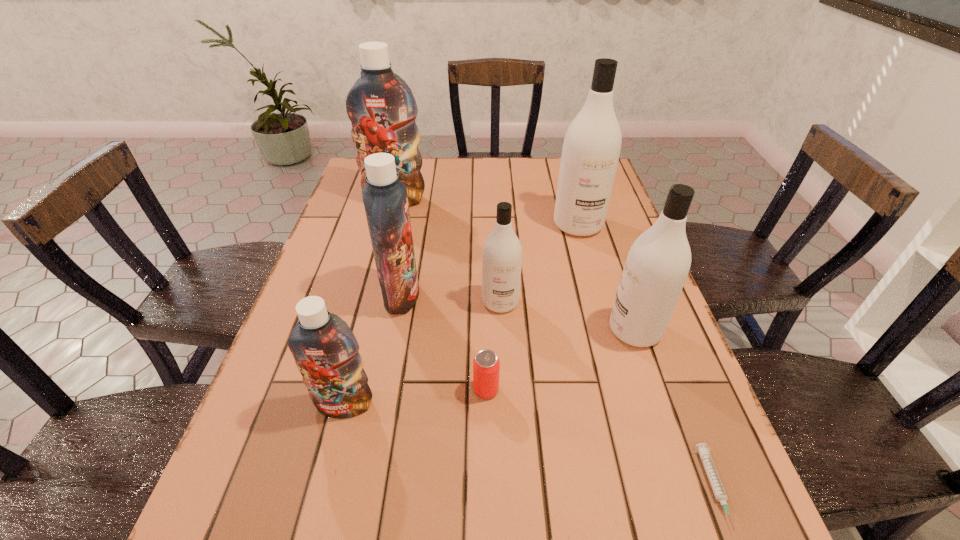
In order to click on free space located on the front label of the nearest shampoo in this screenshot , I will do `click(329, 462)`.

The height and width of the screenshot is (540, 960). I want to click on free space located on the front-facing side of the leftmost white shampoo, so click(x=502, y=346).

The image size is (960, 540). Find the location of `vacant region located on the right of the beer can`. vacant region located on the right of the beer can is located at coordinates (529, 390).

You are a GUI agent. You are given a task and a screenshot of the screen. Output one action in this format:
    pyautogui.click(x=<x>, y=<y>)
    Task: Click on the object that is at the far edge
    
    Given the screenshot: What is the action you would take?
    pyautogui.click(x=381, y=107)

Find the location of a particular element. object present at the near edge is located at coordinates (712, 474).

Find the location of a particular element. syringe that is at the right edge is located at coordinates (712, 474).

At what (x,y) coordinates should I click in order to perform the action: click on object located in the far left corner section of the desktop. Please return your answer as a coordinate pair (x, y). Looking at the image, I should click on (381, 107).

In order to click on object at the near right corner in this screenshot , I will do `click(712, 474)`.

This screenshot has height=540, width=960. What are the coordinates of `vacant space at the far edge of the desktop` in the screenshot? It's located at (470, 170).

Locate an element on the screen. The height and width of the screenshot is (540, 960). free space at the left edge is located at coordinates (352, 302).